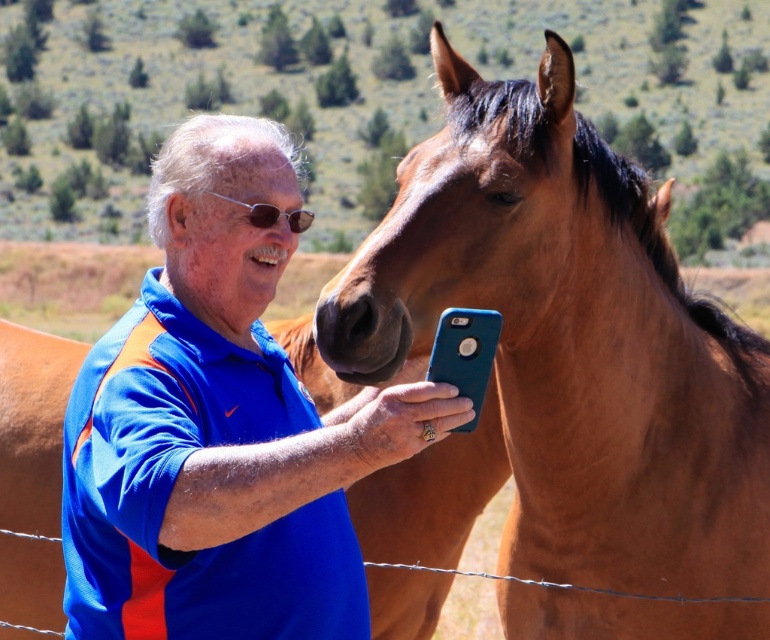
Can you confirm if brown matte horse at center is smaller than blue fabric shirt at center?

Incorrect, brown matte horse at center is not smaller in size than blue fabric shirt at center.

Which is below, brown matte horse at center or blue fabric shirt at center?

Positioned lower is blue fabric shirt at center.

Is point (452, 259) in front of point (142, 440)?

No, (452, 259) is behind (142, 440).

The height and width of the screenshot is (640, 770). I want to click on brown matte horse at center, so click(571, 340).

Is brown matte horse at center smaller than sunglasses at center?

No, brown matte horse at center is not smaller than sunglasses at center.

Who is taller, brown matte horse at center or sunglasses at center?

brown matte horse at center is taller.

Between point (501, 410) and point (303, 212), which one is positioned behind?

The point (501, 410) is behind.

Identify the location of brown matte horse at center. (571, 340).

Who is more distant from viewer, (283, 429) or (256, 218)?

The point (283, 429) is more distant.

Which is more to the right, blue fabric shirt at center or sunglasses at center?

Positioned to the right is sunglasses at center.

This screenshot has width=770, height=640. I want to click on blue fabric shirt at center, so click(221, 426).